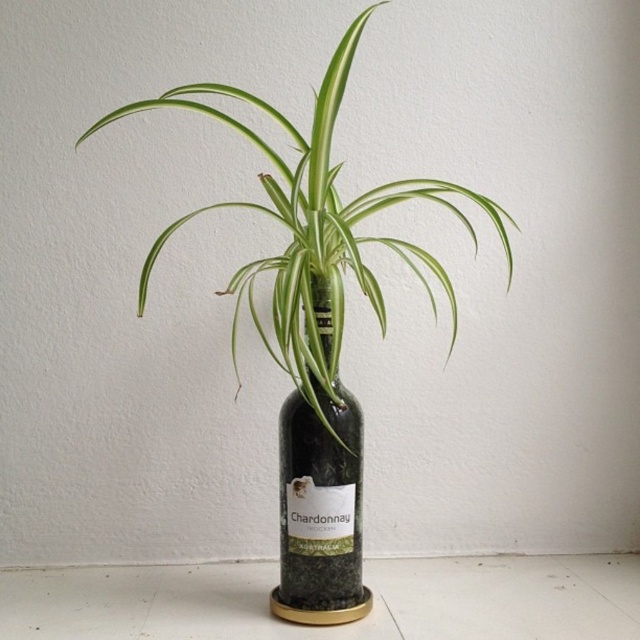
Question: Can you confirm if green leafy plant at center is positioned below green glass bottle at center?

Choices:
 (A) yes
 (B) no

Answer: (B)

Question: Among these points, which one is nearest to the camera?

Choices:
 (A) (291, 573)
 (B) (348, 227)

Answer: (B)

Question: Does green leafy plant at center have a greater width compared to green glass bottle at center?

Choices:
 (A) yes
 (B) no

Answer: (A)

Question: Is green leafy plant at center thinner than green glass bottle at center?

Choices:
 (A) yes
 (B) no

Answer: (B)